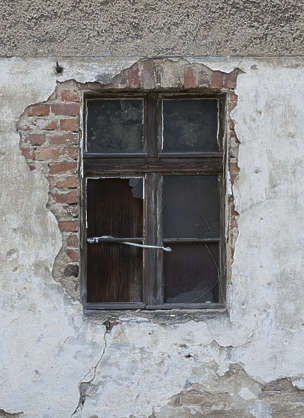
Identify the location of the bottom window. The width and height of the screenshot is (304, 418). [112, 268], [174, 280].